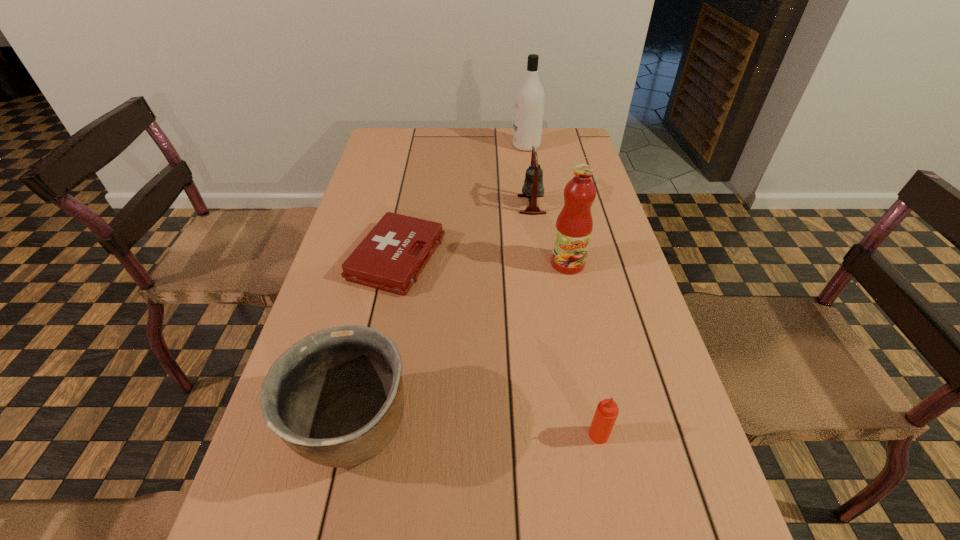
At what (x,y) coordinates should I click in order to perform the action: click on vacant space situated on the left of the bell. Please return your answer as a coordinate pair (x, y). Image resolution: width=960 pixels, height=540 pixels. Looking at the image, I should click on (473, 205).

Locate an element on the screen. vacant space located 0.160m on the right of the pottery is located at coordinates (501, 428).

At what (x,y) coordinates should I click in order to perform the action: click on free space located on the back of the second shortest object. Please return your answer as a coordinate pair (x, y). The width and height of the screenshot is (960, 540). Looking at the image, I should click on click(x=575, y=320).

Locate an element on the screen. free space located on the back of the shortest object is located at coordinates (407, 206).

The width and height of the screenshot is (960, 540). Identify the location of object that is at the far edge. [530, 98].

Find the location of a particular element. The height and width of the screenshot is (540, 960). pottery that is at the left edge is located at coordinates (336, 397).

Find the location of a particular element. The image size is (960, 540). the first-aid kit at the left edge is located at coordinates (390, 258).

Find the location of a particular element. This screenshot has height=540, width=960. shampoo at the right edge is located at coordinates (530, 98).

Where is `fruit juice at the right edge`? The width and height of the screenshot is (960, 540). fruit juice at the right edge is located at coordinates (574, 225).

Find the location of a particular element. The height and width of the screenshot is (540, 960). Tabasco sauce located in the right edge section of the desktop is located at coordinates (606, 413).